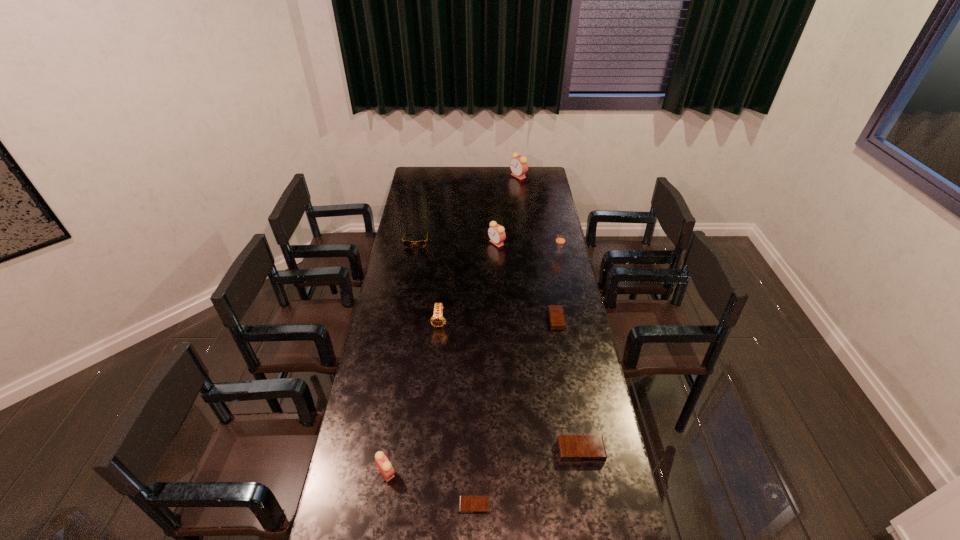
Find the location of a particular element. black sunglasses is located at coordinates (421, 243).

The width and height of the screenshot is (960, 540). I want to click on the third shortest object, so click(572, 448).

At what (x,y) coordinates should I click in order to perform the action: click on the second farthest black alarm clock. Please return your answer as a coordinate pair (x, y). This screenshot has width=960, height=540. Looking at the image, I should click on (572, 448).

I want to click on the third farthest alarm clock, so click(556, 316).

Find the location of a particular element. The height and width of the screenshot is (540, 960). the second smallest black alarm clock is located at coordinates (556, 316).

At what (x,y) coordinates should I click in order to perform the action: click on the smallest black alarm clock. Please return your answer as a coordinate pair (x, y). Looking at the image, I should click on (467, 504).

I want to click on the shortest object, so click(x=467, y=504).

Image resolution: width=960 pixels, height=540 pixels. I want to click on vacant space located on the face of the tallest alarm clock, so pyautogui.click(x=455, y=176).

Find the location of `vacant point located on the face of the tallest alarm clock`. vacant point located on the face of the tallest alarm clock is located at coordinates (497, 176).

You are a GUI agent. You are given a task and a screenshot of the screen. Output one action in this format:
    pyautogui.click(x=<x>, y=<y>)
    Task: Click on the free region located 0.130m on the face of the tallest alarm clock
    The width and height of the screenshot is (960, 540).
    Given the screenshot: What is the action you would take?
    pyautogui.click(x=490, y=176)